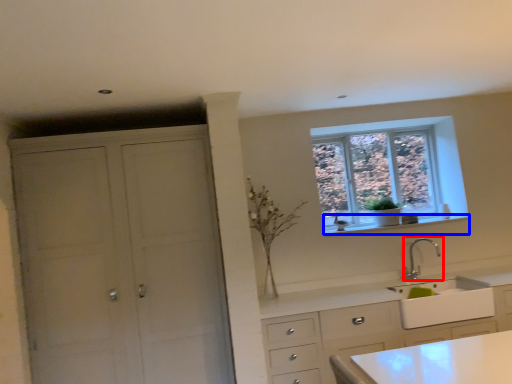
Question: Among these objects, which one is nearest to the camera, tap (highlighted by a red box) or window sill (highlighted by a blue box)?

Choices:
 (A) tap
 (B) window sill

Answer: (A)